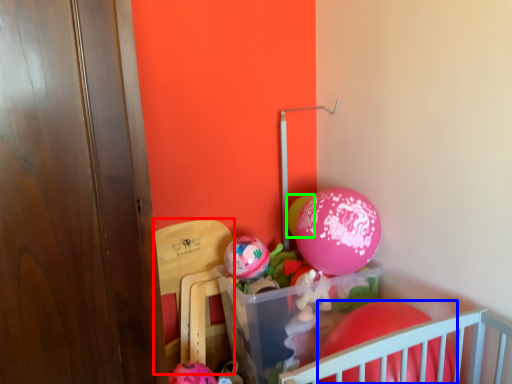
Question: Considering the real-world distances, which object is closest to armchair (highlighted by a red box)? balloon (highlighted by a blue box) or balloon (highlighted by a green box).

Choices:
 (A) balloon
 (B) balloon

Answer: (B)